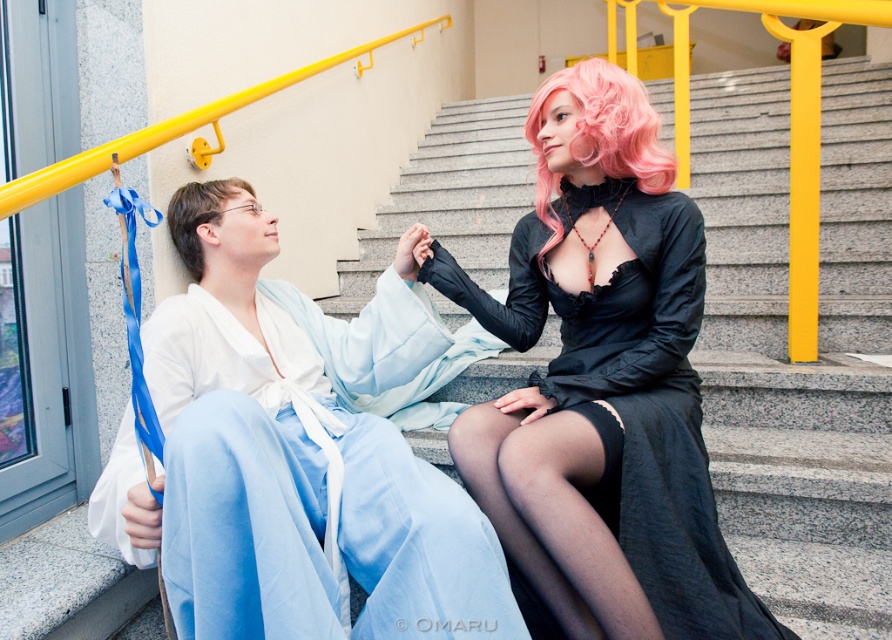
You are a photographer trying to capture a closeup of both the pink curly wig at upper right and the light brown silky hair at upper left. Since you can only focus on one subject at a time, which one should you choose to ensure the other is still in the frame?

The pink curly wig at upper right is positioned on the right side of light brown silky hair at upper left, so if you focus on the light brown silky hair at upper left, the pink curly wig at upper right will still be visible on its right side. Alternatively, focusing on the pink curly wig at upper right would still keep the light brown silky hair at upper left on its left side. Either choice keeps both in frame as they are positioned next to each other.

You are a photographer setting up a shoot on the staircase. You need to position a spotlight so it illuminates both the light blue silk robe at lower left and the pink curly wig at upper right. Where should you place the spotlight to ensure both objects are lit without casting shadows between them?

The light blue silk robe at lower left is below the pink curly wig at upper right. To avoid shadows, place the spotlight above and between the two objects so the light reaches both the lower robe and the upper wig without obstruction.

You are standing at the bottom of the staircase and want to pick up the light blue silk robe at lower left. What are the coordinates where you should look to find it?

The light blue silk robe at lower left is located at coordinates point (395, 460).